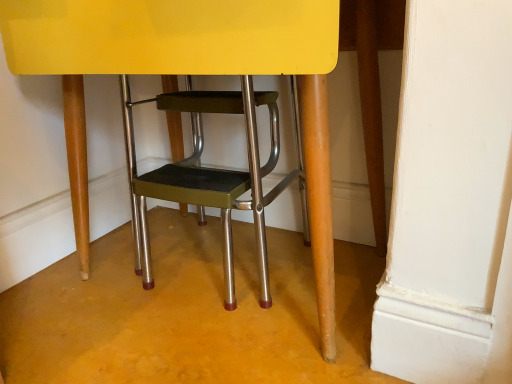
Question: In terms of width, does metallic green step stool at center look wider or thinner when compared to metallic green stool at center?

Choices:
 (A) wide
 (B) thin

Answer: (A)

Question: Is metallic green step stool at center inside the boundaries of metallic green stool at center, or outside?

Choices:
 (A) inside
 (B) outside

Answer: (A)

Question: Based on their positions, is metallic green step stool at center located to the left or right of metallic green stool at center?

Choices:
 (A) left
 (B) right

Answer: (B)

Question: From the image's perspective, is metallic green stool at center located above or below metallic green step stool at center?

Choices:
 (A) below
 (B) above

Answer: (A)

Question: Considering their positions, is metallic green stool at center located in front of or behind metallic green step stool at center?

Choices:
 (A) front
 (B) behind

Answer: (B)

Question: Is metallic green stool at center taller or shorter than metallic green step stool at center?

Choices:
 (A) short
 (B) tall

Answer: (A)

Question: Based on their positions, is metallic green stool at center located to the left or right of metallic green step stool at center?

Choices:
 (A) left
 (B) right

Answer: (A)